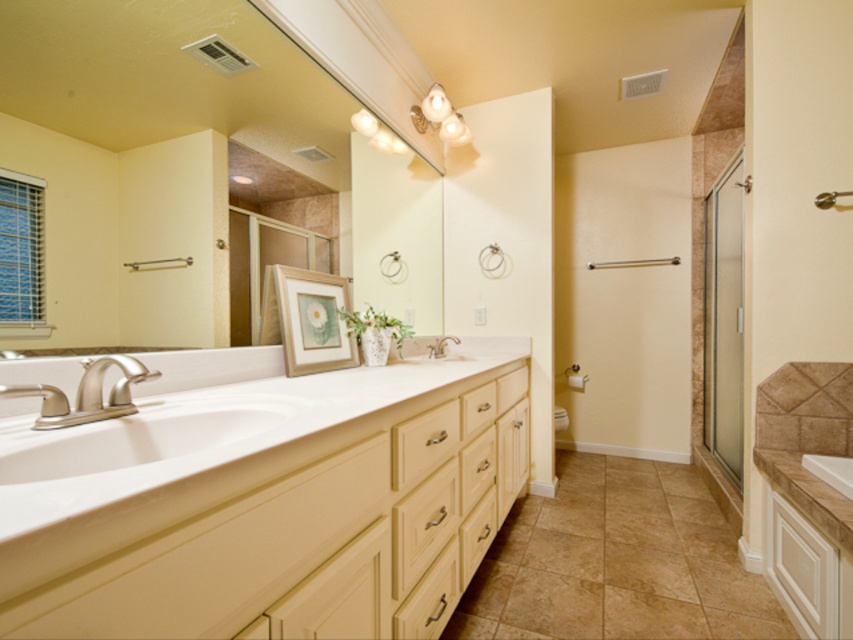
Question: Can you confirm if matte white mirror at upper center is bigger than white glossy sink at center?

Choices:
 (A) yes
 (B) no

Answer: (A)

Question: Does brushed nickel faucet at left appear on the right side of brushed metal faucet at center?

Choices:
 (A) yes
 (B) no

Answer: (B)

Question: Is white laminate countertop at center further to camera compared to brushed metal faucet at center?

Choices:
 (A) yes
 (B) no

Answer: (B)

Question: Estimate the real-world distances between objects in this image. Which object is closer to the white glossy sink at center?

Choices:
 (A) white laminate countertop at center
 (B) brushed nickel faucet at left
 (C) brushed metal faucet at center

Answer: (C)

Question: Which of these objects is positioned closest to the brushed nickel faucet at left?

Choices:
 (A) matte white mirror at upper center
 (B) white glossy sink at center

Answer: (A)

Question: Among these points, which one is farthest from the camera?

Choices:
 (A) (68, 323)
 (B) (428, 344)
 (C) (207, 461)

Answer: (B)